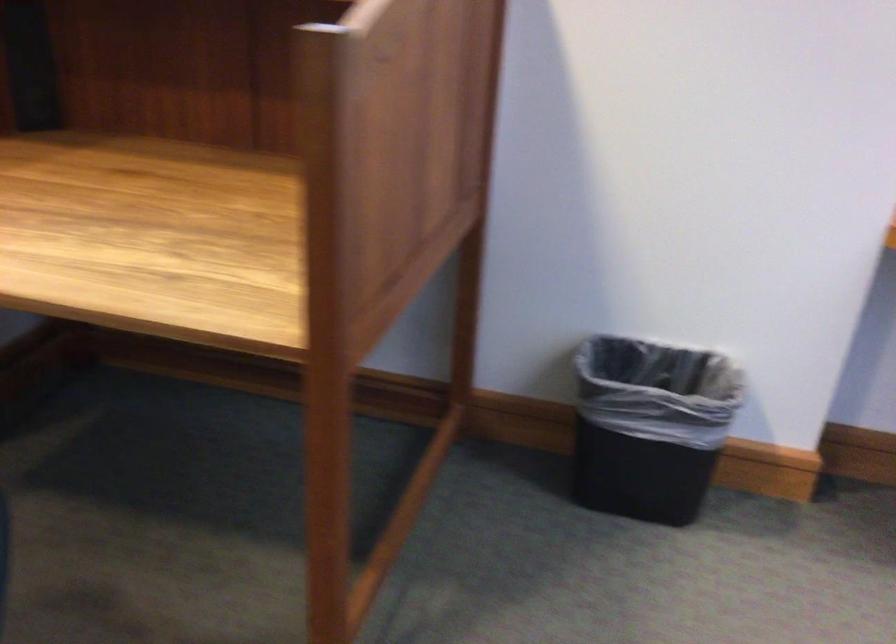
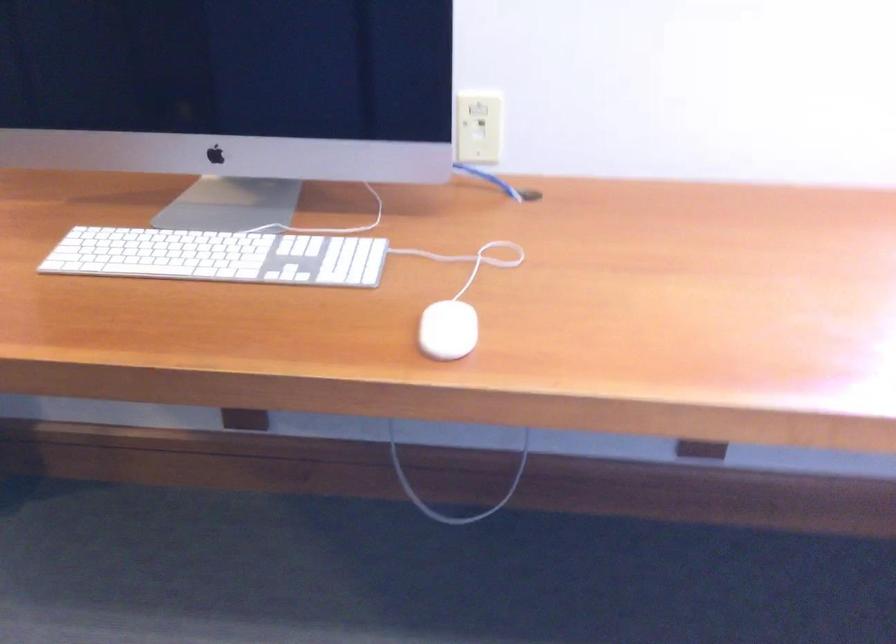
Question: In a continuous first-person perspective shot, in which direction is the camera moving?

Choices:
 (A) Left
 (B) Right
 (C) Forward
 (D) Backward

Answer: (B)